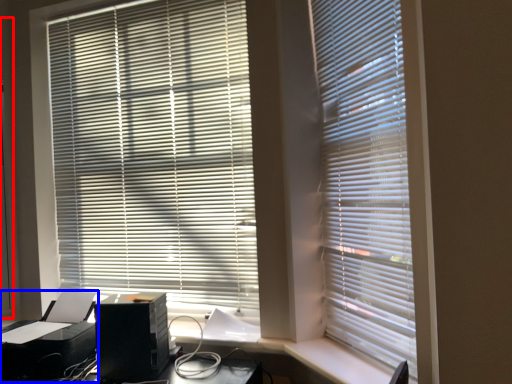
Question: Which of the following is the farthest to the observer, screen door (highlighted by a red box) or printer (highlighted by a blue box)?

Choices:
 (A) screen door
 (B) printer

Answer: (A)